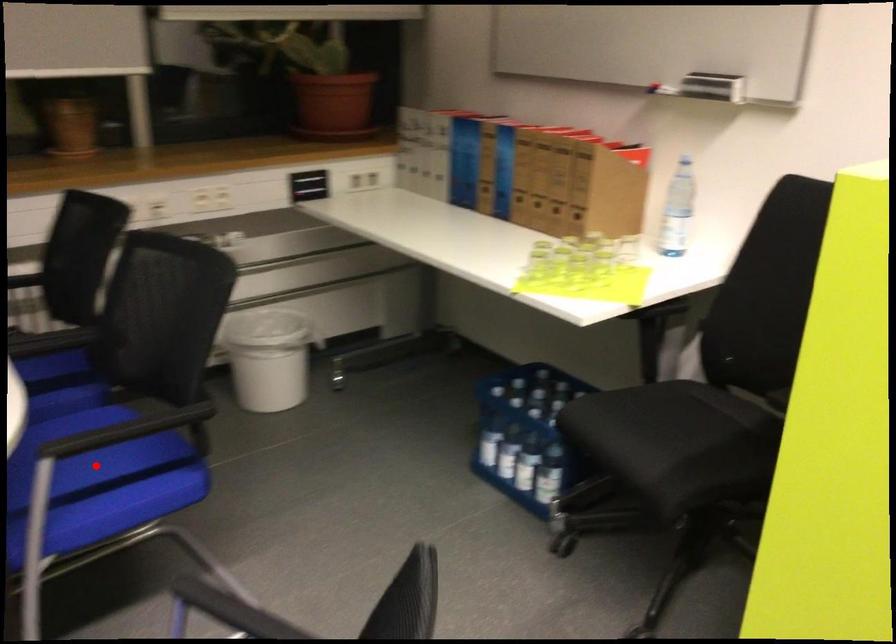
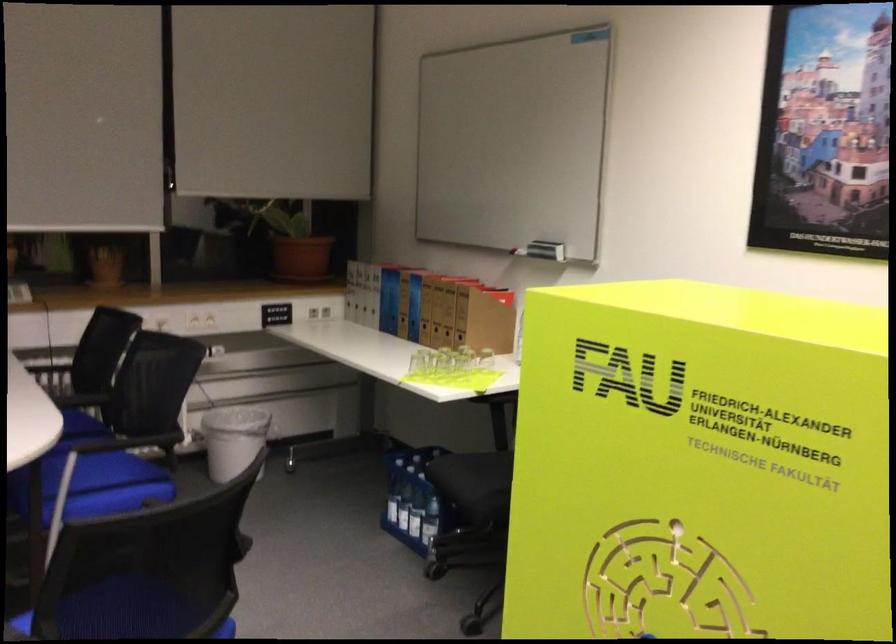
Question: I am providing you with two images of the same scene from different viewpoints. Given a red point in image1, look at the same physical point in image2. Is it:

Choices:
 (A) Closer to the viewpoint
 (B) Farther from the viewpoint

Answer: (B)